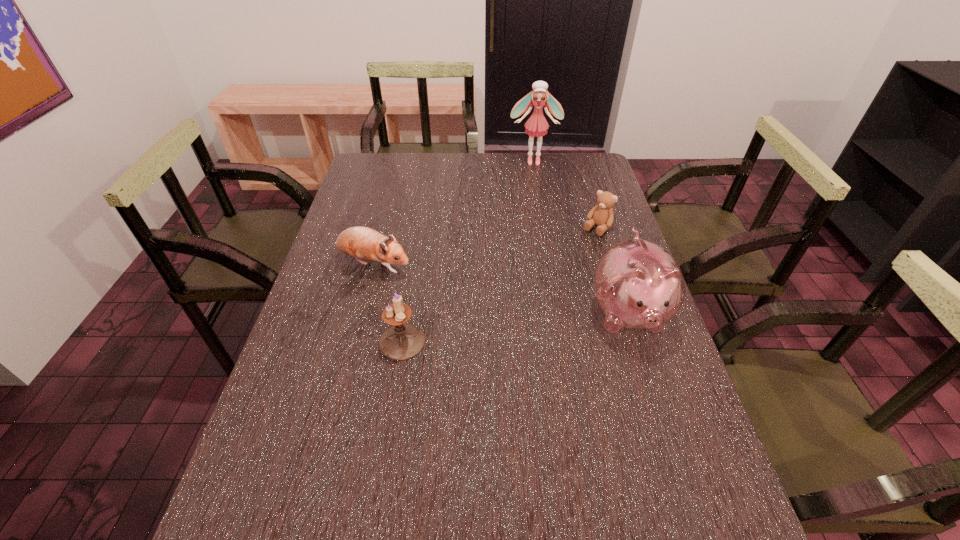
This screenshot has height=540, width=960. I want to click on candle holder, so click(402, 341).

This screenshot has height=540, width=960. Identify the location of the fourth shortest object. (638, 284).

Identify the location of hamster. This screenshot has width=960, height=540. (363, 243).

Identify the location of teddy bear. (602, 215).

You are a GUI agent. You are given a task and a screenshot of the screen. Output one action in this format:
    pyautogui.click(x=<x>, y=<y>)
    Task: Click on the farthest object
    The image size is (960, 540).
    Given the screenshot: What is the action you would take?
    pyautogui.click(x=536, y=125)

Identify the location of the tallest object. The width and height of the screenshot is (960, 540). (536, 125).

Identify the location of vacant space located 0.170m on the right of the third shortest object. The width and height of the screenshot is (960, 540). (494, 342).

I want to click on blank area located on the front facing side of the second tallest object, so click(x=664, y=425).

In order to click on vacant space positioned at the face of the hamster in this screenshot , I will do `click(491, 307)`.

What are the coordinates of `vacant space located 0.300m at the face of the hamster` in the screenshot? It's located at (497, 310).